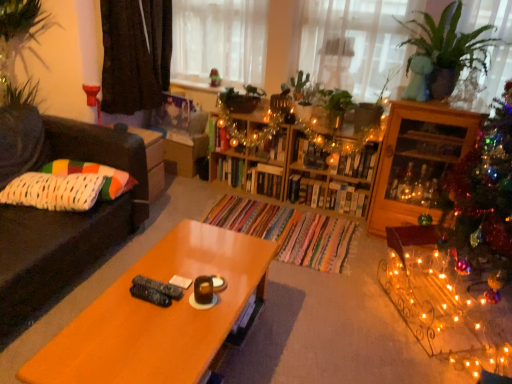
The image size is (512, 384). Describe the element at coordinates (339, 173) in the screenshot. I see `wooden bookshelf at center, which is the 2th shelf from left to right` at that location.

This screenshot has height=384, width=512. What do you see at coordinates (335, 106) in the screenshot? I see `green leafy plant at center` at bounding box center [335, 106].

In order to face green leafy plant at center, should I rotate leftwards or rightwards?

Rotate your view right by about 11.171°.

The width and height of the screenshot is (512, 384). Describe the element at coordinates (252, 151) in the screenshot. I see `wooden bookshelf at center, placed as the 2th shelf when sorted from right to left` at that location.

This screenshot has height=384, width=512. Identify the location of wooden bookshelf at center, which is the 2th shelf from left to right. (339, 173).

Can you confirm if wooden bookshelf at center is shorter than wooden bookshelf at center, arranged as the first shelf when viewed from the left?

Yes, wooden bookshelf at center is shorter than wooden bookshelf at center, arranged as the first shelf when viewed from the left.

Could you measure the distance between wooden bookshelf at center and wooden bookshelf at center, placed as the 2th shelf when sorted from right to left?

wooden bookshelf at center is 3.61 inches away from wooden bookshelf at center, placed as the 2th shelf when sorted from right to left.

Is wooden bookshelf at center closer to the viewer compared to wooden bookshelf at center, placed as the 2th shelf when sorted from right to left?

Yes, wooden bookshelf at center is closer to the camera.

Based on the photo, considering the sizes of objects wooden bookshelf at center and green leafy plant at center in the image provided, who is bigger, wooden bookshelf at center or green leafy plant at center?

wooden bookshelf at center.

From the image's perspective, who appears lower, wooden bookshelf at center or green leafy plant at center?

wooden bookshelf at center appears lower in the image.

From a real-world perspective, is wooden bookshelf at center physically above green leafy plant at center?

Incorrect, from a real-world perspective, wooden bookshelf at center is lower than green leafy plant at center.

Is wooden bookshelf at center positioned behind green leafy plant at center?

Yes, it is.

What's the angular difference between translucent fabric at upper center and green leafy plant at center's facing directions?

The angle between the facing direction of translucent fabric at upper center and the facing direction of green leafy plant at center is 2.07 degrees.

Which object is positioned more to the right, translucent fabric at upper center or green leafy plant at center?

From the viewer's perspective, green leafy plant at center appears more on the right side.

Is translucent fabric at upper center closer to the viewer compared to green leafy plant at center?

No, it is behind green leafy plant at center.

In terms of size, does translucent fabric at upper center appear bigger or smaller than green leafy plant at center?

translucent fabric at upper center is bigger than green leafy plant at center.

From a real-world perspective, which shelf is the 2nd one underneath the white knitted pillow at left, which is the 1th pillow in front-to-back order? Please provide its 2D coordinates.

[(339, 173)]

Does wooden bookshelf at center, positioned as the first shelf in right-to-left order, have a greater height compared to white knitted pillow at left, which is the 1th pillow in front-to-back order?

Yes.

Measure the distance between wooden bookshelf at center, which is the 2th shelf from left to right, and white knitted pillow at left, marked as the 2th pillow in a back-to-front arrangement.

They are 5.21 feet apart.

Does point (371, 156) lie behind point (58, 209)?

Yes, it is behind point (58, 209).

Is wooden bookshelf at center, arranged as the first shelf when viewed from the left, wider or thinner than wooden bookshelf at center?

Considering their sizes, wooden bookshelf at center, arranged as the first shelf when viewed from the left, looks broader than wooden bookshelf at center.

From a real-world perspective, who is located lower, wooden bookshelf at center, placed as the 2th shelf when sorted from right to left, or wooden bookshelf at center?

wooden bookshelf at center, placed as the 2th shelf when sorted from right to left.

Is wooden bookshelf at center, arranged as the first shelf when viewed from the left, bigger than wooden bookshelf at center?

Yes, wooden bookshelf at center, arranged as the first shelf when viewed from the left, is bigger than wooden bookshelf at center.

Between point (242, 173) and point (341, 159), which one is positioned behind?

The point (242, 173) is more distant.

In the scene shown: From the image's perspective, which is above, wooden cabinet at right or green glossy plant at upper right?

From the image's view, green glossy plant at upper right is above.

From a real-world perspective, between wooden cabinet at right and green glossy plant at upper right, who is vertically lower?

wooden cabinet at right is physically lower.

How far apart are wooden cabinet at right and green glossy plant at upper right?

wooden cabinet at right is 42.14 centimeters from green glossy plant at upper right.

Consider the image. Can you confirm if wooden cabinet at right is taller than green glossy plant at upper right?

Yes, wooden cabinet at right is taller than green glossy plant at upper right.

Does multicolored fabric pillow at left, the second pillow when ordered from front to back, touch green glossy plant at upper right?

No.

Does point (119, 190) come farther from viewer compared to point (450, 19)?

No, (119, 190) is closer to viewer.

From their relative heights in the image, would you say multicolored fabric pillow at left, which is the first pillow in back-to-front order, is taller or shorter than green glossy plant at upper right?

multicolored fabric pillow at left, which is the first pillow in back-to-front order, is shorter than green glossy plant at upper right.

Identify the location of houseplant on the right of multicolored fabric pillow at left, which is the first pillow in back-to-front order. (448, 48).

What are the coordinates of `shelf that is the 1st object located below the wooden bookshelf at center (from the image's perspective)` in the screenshot? It's located at click(252, 151).

Locate an element on the screen. Image resolution: width=512 pixels, height=384 pixels. bookcase directly beneath the green leafy plant at center (from a real-world perspective) is located at coordinates (296, 160).

Which object lies further to the anchor point translucent glass window at upper center, dark brown fabric at upper left or wooden coffee table at center?

wooden coffee table at center.

From the image, which object appears to be nearer to wooden bookshelf at center, positioned as the first shelf in right-to-left order, wooden cabinet at right or dark brown fabric at upper left?

wooden cabinet at right.

In the scene shown: Which object lies nearer to the anchor point translucent glass window at upper center, wooden cabinet at right or white knitted pillow at left, which is the 1th pillow in front-to-back order?

wooden cabinet at right is positioned closer to the anchor translucent glass window at upper center.

Based on their spatial positions, is multicolored fabric pillow at left, the second pillow when ordered from front to back, or green glossy plant at upper right further from wooden coffee table at center?

Based on the image, green glossy plant at upper right appears to be further to wooden coffee table at center.

Estimate the real-world distances between objects in this image. Which object is further from green glossy plant at upper right, translucent glass window at upper center or brown leather couch at left?

Among the two, brown leather couch at left is located further to green glossy plant at upper right.

Which object lies nearer to the anchor point multicolored fabric pillow at left, which is the first pillow in back-to-front order, wooden bookshelf at center or white knitted pillow at left, marked as the 2th pillow in a back-to-front arrangement?

white knitted pillow at left, marked as the 2th pillow in a back-to-front arrangement, lies closer to multicolored fabric pillow at left, which is the first pillow in back-to-front order, than the other object.

Based on their spatial positions, is wooden coffee table at center or multicolored fabric pillow at left, which is the first pillow in back-to-front order, further from wooden bookshelf at center, which is the 2th shelf from left to right?

wooden coffee table at center.

Consider the image. Which object lies further to the anchor point wooden coffee table at center, wooden bookshelf at center, placed as the 2th shelf when sorted from right to left, or white knitted pillow at left, marked as the 2th pillow in a back-to-front arrangement?

wooden bookshelf at center, placed as the 2th shelf when sorted from right to left, is positioned further to the anchor wooden coffee table at center.

Find the location of `window screen located between multicolored fabric pillow at left, the second pillow when ordered from front to back, and wooden cabinet at right in the left-right direction`. window screen located between multicolored fabric pillow at left, the second pillow when ordered from front to back, and wooden cabinet at right in the left-right direction is located at coordinates (219, 40).

Locate an element on the screen. This screenshot has height=384, width=512. window between dark brown fabric at upper left and wooden cabinet at right in the horizontal direction is located at coordinates (354, 43).

This screenshot has height=384, width=512. In order to click on coffee table between brown leather couch at left and wooden bookshelf at center, positioned as the first shelf in right-to-left order, from left to right in this screenshot , I will do `click(157, 315)`.

Where is `window screen between white knitted pillow at left, which is the 1th pillow in front-to-back order, and translucent glass window at upper center from left to right`? The height and width of the screenshot is (384, 512). window screen between white knitted pillow at left, which is the 1th pillow in front-to-back order, and translucent glass window at upper center from left to right is located at coordinates (219, 40).